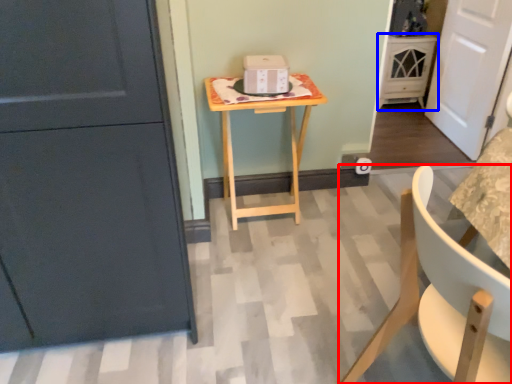
Question: Among these objects, which one is nearest to the camera, chair (highlighted by a red box) or cabinetry (highlighted by a blue box)?

Choices:
 (A) chair
 (B) cabinetry

Answer: (A)